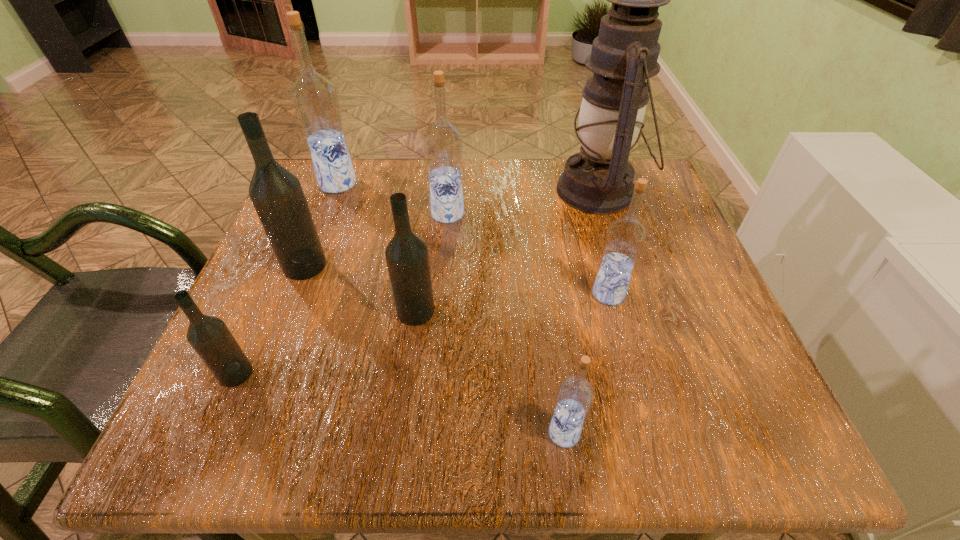
This screenshot has height=540, width=960. I want to click on free point located on the front of the third biggest blue vodka, so click(618, 330).

Identify the location of free space located 0.220m on the back of the smallest black vodka. The height and width of the screenshot is (540, 960). (285, 263).

Find the location of `free space located 0.300m on the back of the third blue vodka from left to right`. free space located 0.300m on the back of the third blue vodka from left to right is located at coordinates (541, 269).

The image size is (960, 540). What are the coordinates of `oil lamp located in the far edge section of the desktop` in the screenshot? It's located at point(599,179).

Identify the location of object located in the near edge section of the desktop. (575, 395).

Find the location of a particular element. Image resolution: width=960 pixels, height=540 pixels. oil lamp located in the right edge section of the desktop is located at coordinates [599, 179].

Find the location of a particular element. vodka that is at the right edge is located at coordinates click(626, 236).

This screenshot has width=960, height=540. I want to click on object present at the far left corner, so click(315, 99).

This screenshot has width=960, height=540. What are the coordinates of `object that is positioned at the far right corner` in the screenshot? It's located at (599, 179).

In order to click on blank space at the far edge of the desktop in this screenshot , I will do `click(521, 188)`.